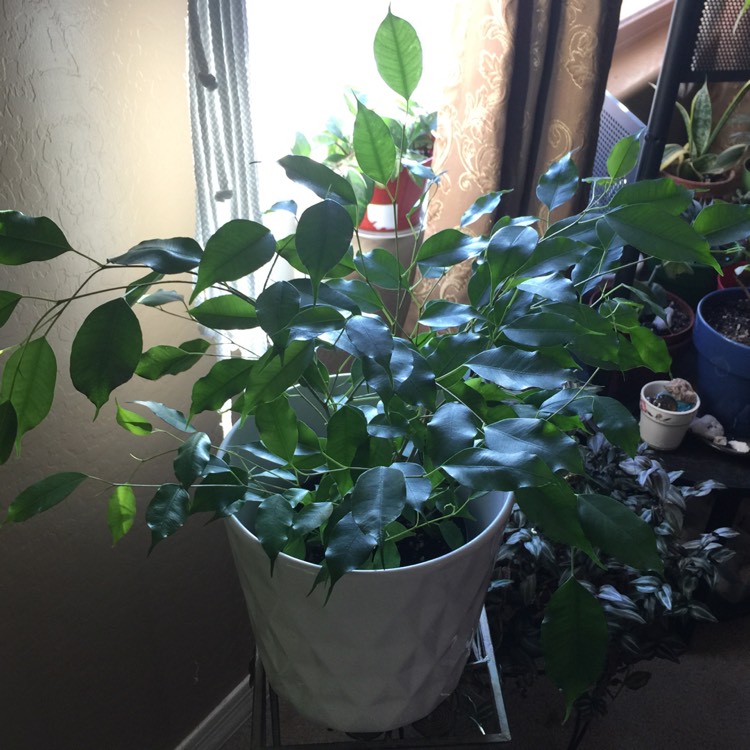
You are a GUI agent. You are given a task and a screenshot of the screen. Output one action in this format:
    pyautogui.click(x=<x>, y=<y>)
    Task: Click on the pot in center of image
    
    Given the screenshot: What is the action you would take?
    pyautogui.click(x=370, y=616)